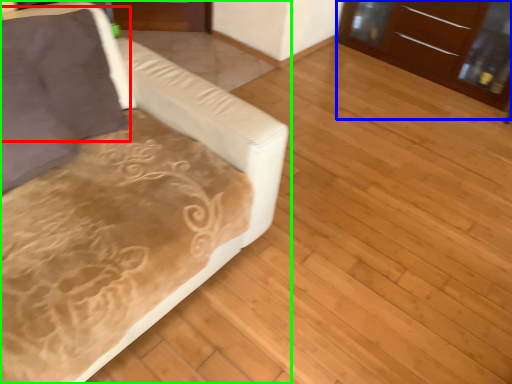
Question: Based on their relative distances, which object is nearer to pillow (highlighted by a red box)? Choose from dresser (highlighted by a blue box) and studio couch (highlighted by a green box).

Choices:
 (A) dresser
 (B) studio couch

Answer: (B)